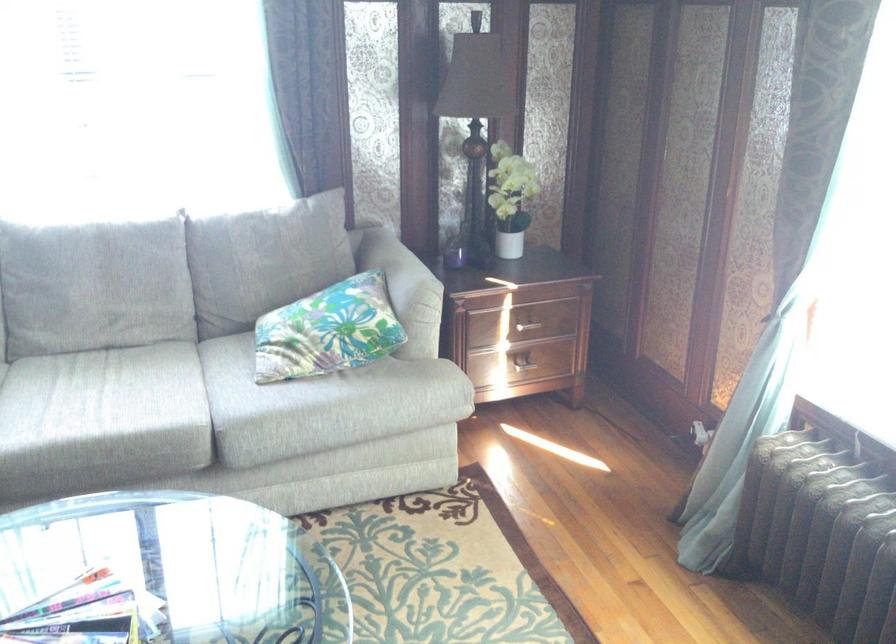
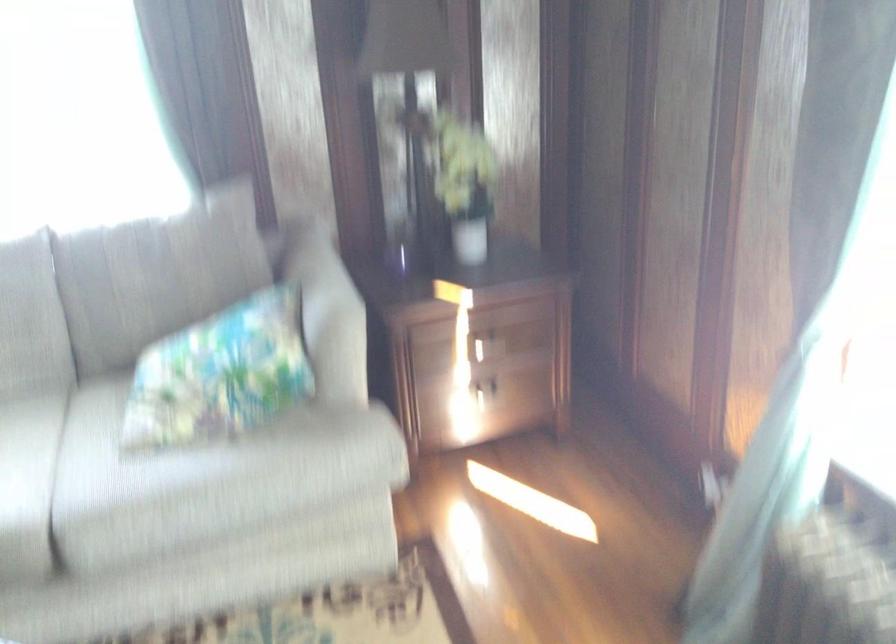
The point at (507, 194) is marked in the first image. Where is the corresponding point in the second image?

(464, 184)